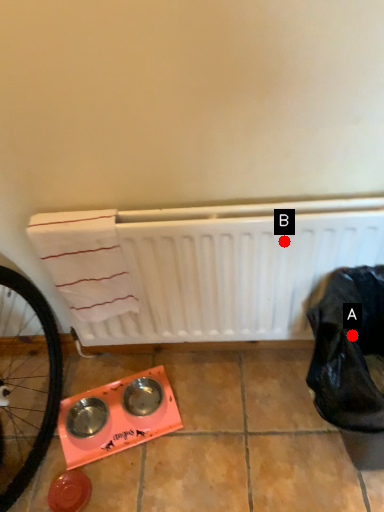
Question: Two points are circled on the image, labeled by A and B beside each circle. Which point is closer to the camera?

Choices:
 (A) A is closer
 (B) B is closer

Answer: (A)